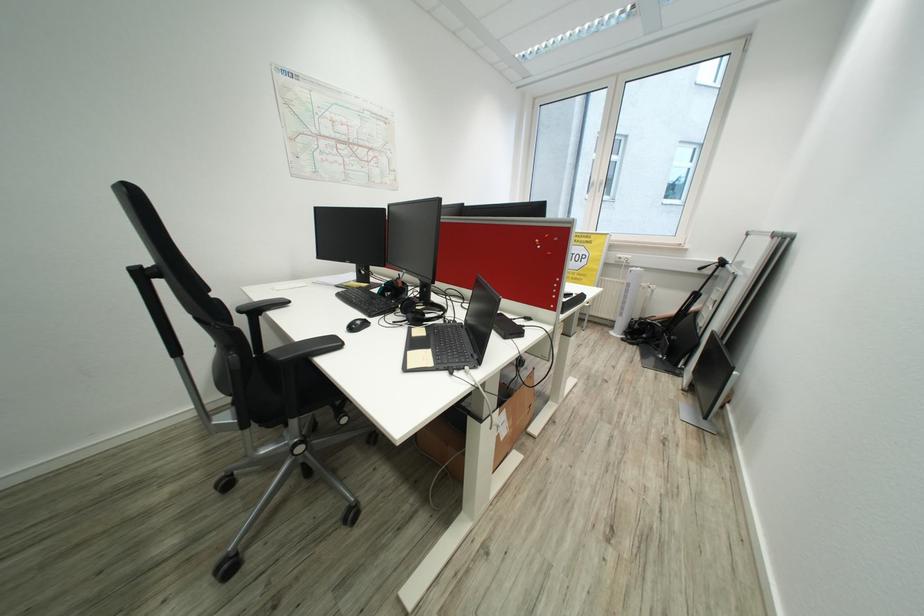
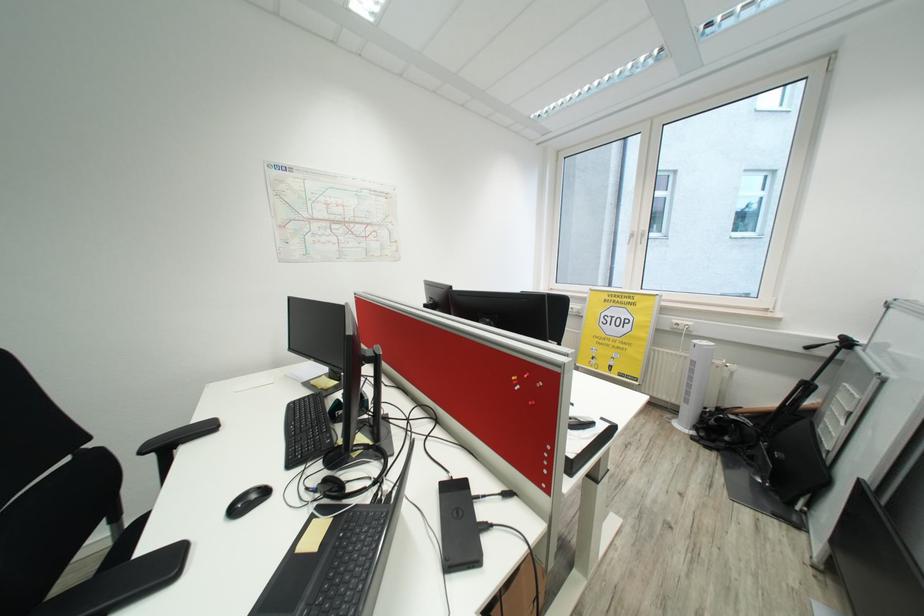
Question: The first image is from the beginning of the video and the second image is from the end. How did the camera likely rotate when shooting the video?

Choices:
 (A) Left
 (B) Right
 (C) Up
 (D) Down

Answer: (A)